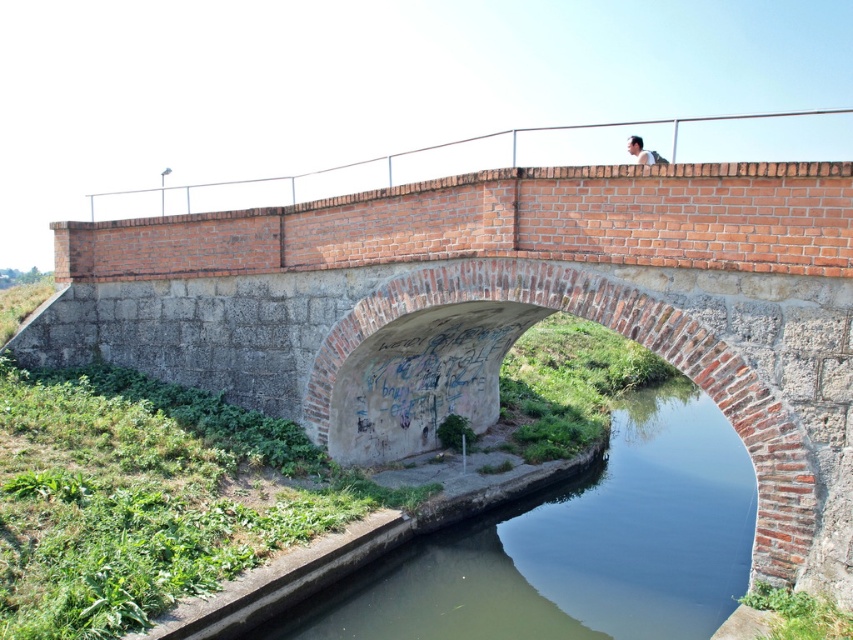
Who is shorter, green concrete river at center or white metal rail at upper center?

green concrete river at center

In the scene shown: Does green concrete river at center come in front of white metal rail at upper center?

That is True.

Does point (555, 592) come closer to viewer compared to point (289, 192)?

Yes, point (555, 592) is closer to viewer.

Identify the location of green concrete river at center. (575, 547).

Does green concrete river at center appear on the left side of white shirt at upper center?

Correct, you'll find green concrete river at center to the left of white shirt at upper center.

Who is positioned more to the right, green concrete river at center or white shirt at upper center?

From the viewer's perspective, white shirt at upper center appears more on the right side.

This screenshot has width=853, height=640. I want to click on green concrete river at center, so click(x=575, y=547).

Between white metal rail at upper center and white shirt at upper center, which one appears on the right side from the viewer's perspective?

white shirt at upper center is more to the right.

Consider the image. Between white metal rail at upper center and white shirt at upper center, which one has more height?

With more height is white metal rail at upper center.

Which is in front, point (387, 164) or point (636, 140)?

Point (636, 140)

Identify the location of white metal rail at upper center. This screenshot has width=853, height=640. coord(509,145).